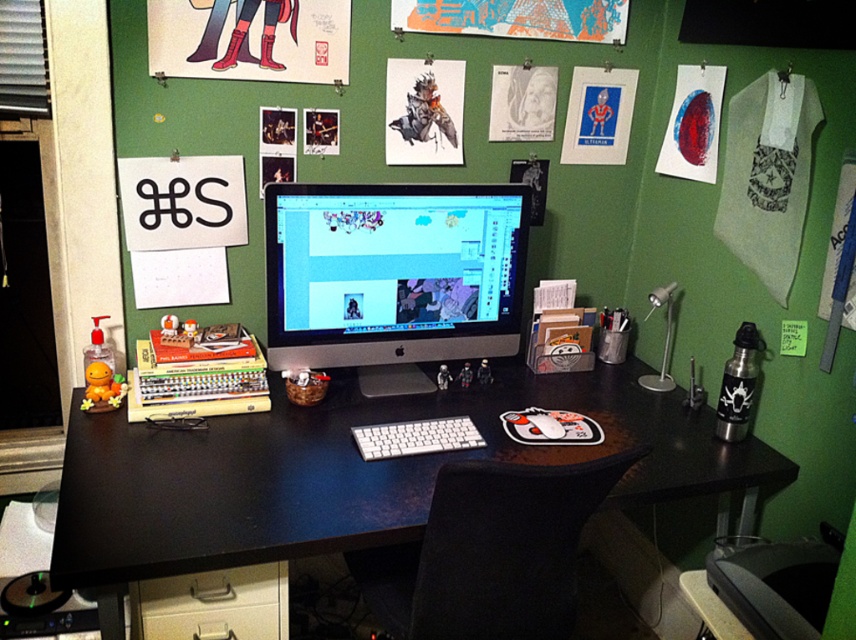
From the picture: Who is taller, satin silver monitor at center or white plastic keyboard at center?

With more height is satin silver monitor at center.

Which is in front, point (501, 307) or point (357, 440)?

Point (357, 440) is more forward.

Locate an element on the screen. satin silver monitor at center is located at coordinates (391, 273).

You are a GUI agent. You are given a task and a screenshot of the screen. Output one action in this format:
    pyautogui.click(x=<x>, y=<y>)
    Task: Click on the satin silver monitor at center
    This screenshot has width=856, height=640.
    Given the screenshot: What is the action you would take?
    pyautogui.click(x=391, y=273)

Does black matte computer desk at center appear over white plastic keyboard at center?

Incorrect, black matte computer desk at center is not positioned above white plastic keyboard at center.

Find the location of a particular element. Image resolution: width=856 pixels, height=640 pixels. black matte computer desk at center is located at coordinates (358, 472).

Can you confirm if black matte computer desk at center is positioned above satin silver monitor at center?

No, black matte computer desk at center is not above satin silver monitor at center.

Which is above, black matte computer desk at center or satin silver monitor at center?

Positioned higher is satin silver monitor at center.

Is point (408, 419) closer to camera compared to point (452, 291)?

Yes, it is in front of point (452, 291).

Identify the location of black matte computer desk at center. This screenshot has width=856, height=640. (358, 472).